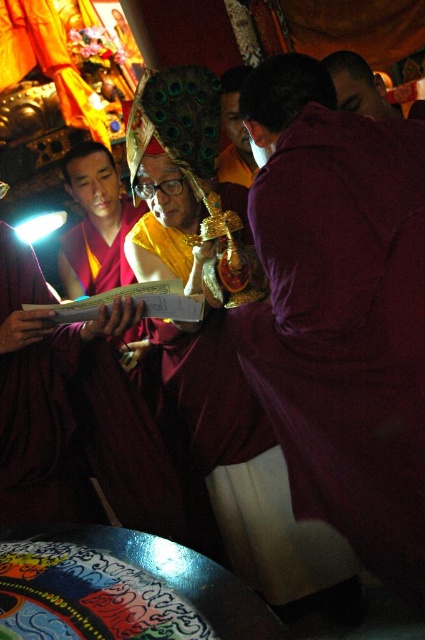
You are standing in front of the image and see the point marked at coordinates (340,310). What object is located at this point?

The point at (340,310) indicates the purple velvet robe at center.

Based on the photo, you are an interior designer planning to place a 1.2 meter wide sofa in this space. The sofa must be placed between the maroon robe at upper right and the matte gold mask at center. Can the sofa fit between them?

The maroon robe at upper right might be wider than matte gold mask at center, so the distance between them is uncertain. Without knowing the exact width, it is not possible to determine if the sofa will fit.